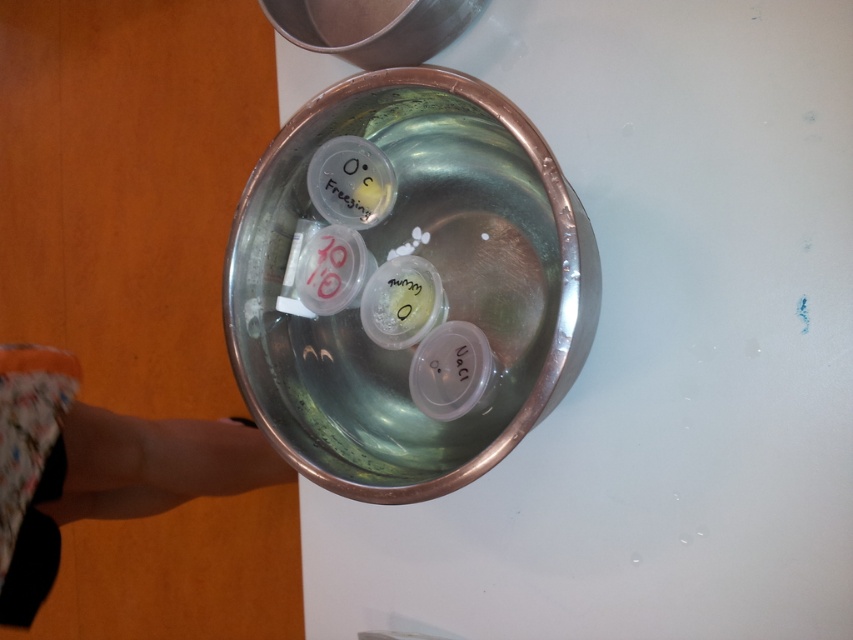
Which is above, shiny metallic bowl at center or floral fabric leg at lower left?

shiny metallic bowl at center is above.

How far apart are shiny metallic bowl at center and floral fabric leg at lower left?

shiny metallic bowl at center is 10.18 inches from floral fabric leg at lower left.

At what (x,y) coordinates should I click in order to perform the action: click on shiny metallic bowl at center. Please return your answer as a coordinate pair (x, y). Looking at the image, I should click on point(438,273).